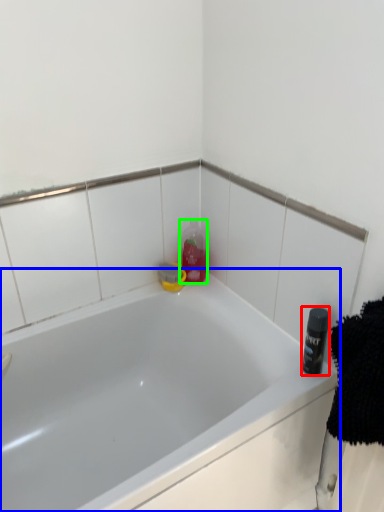
Question: Estimate the real-world distances between objects in this image. Which object is farther from toiletry (highlighted by a red box), bathtub (highlighted by a blue box) or cleaning product (highlighted by a green box)?

Choices:
 (A) bathtub
 (B) cleaning product

Answer: (B)